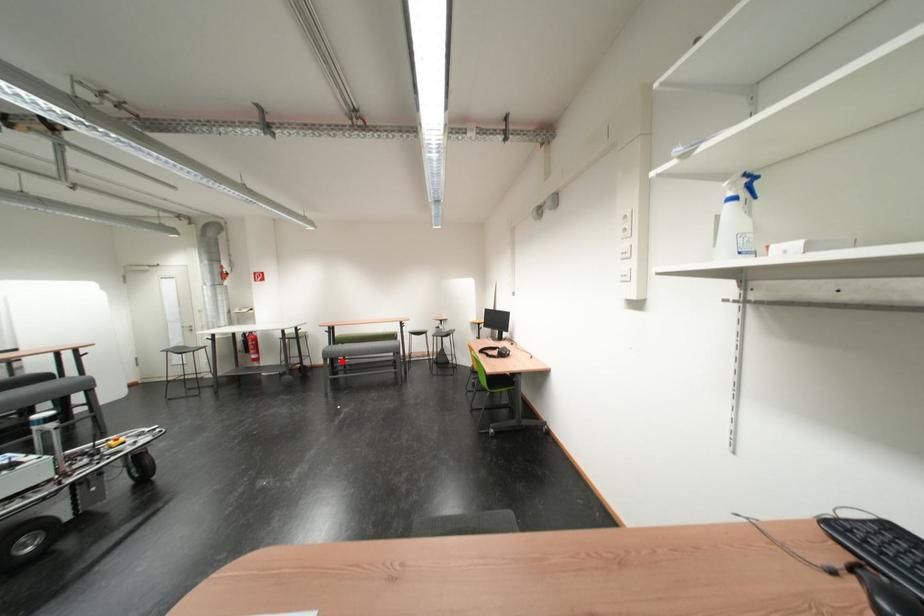
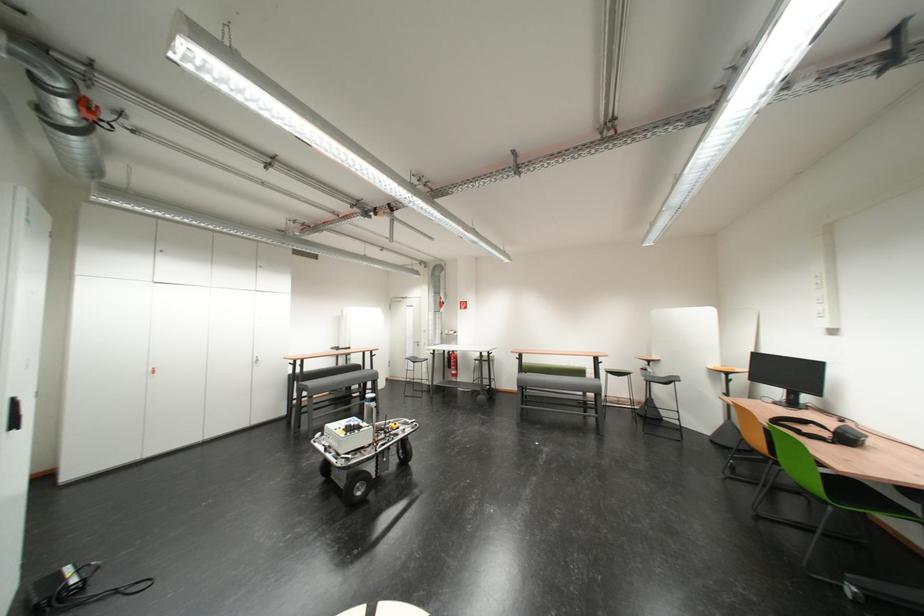
Question: I am providing you with two images of the same scene from different viewpoints. A red point is shown in image1. For the corresponding object point in image2, is it positioned nearer or farther from the camera?

Choices:
 (A) Nearer
 (B) Farther

Answer: (B)